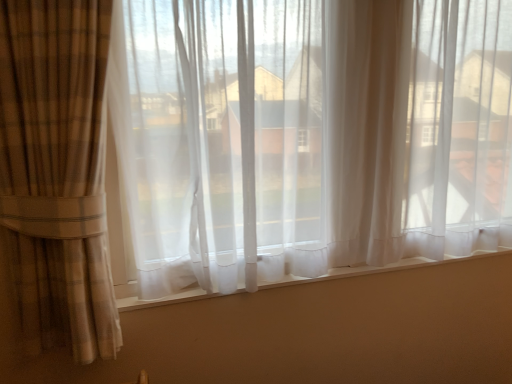
The width and height of the screenshot is (512, 384). Describe the element at coordinates (219, 140) in the screenshot. I see `translucent white curtain at center` at that location.

The image size is (512, 384). In order to click on translucent white curtain at center in this screenshot , I will do `click(219, 140)`.

Describe the element at coordinates (380, 269) in the screenshot. I see `white sheer curtain at center` at that location.

What are the coordinates of `white sheer curtain at center` in the screenshot? It's located at (380, 269).

Where is `translucent white curtain at center`? Image resolution: width=512 pixels, height=384 pixels. translucent white curtain at center is located at coordinates (219, 140).

From the picture: Based on their positions, is translucent white curtain at center located to the left or right of white sheer curtain at center?

translucent white curtain at center is to the right of white sheer curtain at center.

Is the depth of translucent white curtain at center less than that of white sheer curtain at center?

Yes.

Is point (267, 174) positioned before point (480, 251)?

Yes.

From the image's perspective, is translucent white curtain at center below white sheer curtain at center?

Actually, translucent white curtain at center appears above white sheer curtain at center in the image.

From a real-world perspective, is translucent white curtain at center physically located above or below white sheer curtain at center?

From a real-world perspective, translucent white curtain at center is physically above white sheer curtain at center.

Which of these two, translucent white curtain at center or white sheer curtain at center, is thinner?

white sheer curtain at center.

Is translucent white curtain at center taller than white sheer curtain at center?

Indeed, translucent white curtain at center has a greater height compared to white sheer curtain at center.

Is translucent white curtain at center smaller than white sheer curtain at center?

Incorrect, translucent white curtain at center is not smaller in size than white sheer curtain at center.

Is translucent white curtain at center not within white sheer curtain at center?

Yes, translucent white curtain at center is outside of white sheer curtain at center.

Is translucent white curtain at center not close to white sheer curtain at center?

That's not correct — translucent white curtain at center is a little close to white sheer curtain at center.

Is translucent white curtain at center oriented towards white sheer curtain at center?

No.

How many degrees apart are the facing directions of translucent white curtain at center and white sheer curtain at center?

0.000353 degrees.

Measure the distance between translucent white curtain at center and white sheer curtain at center.

translucent white curtain at center and white sheer curtain at center are 18.00 inches apart from each other.

At what (x,y) coordinates should I click in order to perform the action: click on window sill behind the translucent white curtain at center. Please return your answer as a coordinate pair (x, y). This screenshot has height=384, width=512. Looking at the image, I should click on (380, 269).

Considering the positions of objects white sheer curtain at center and translucent white curtain at center in the image provided, who is more to the right, white sheer curtain at center or translucent white curtain at center?

translucent white curtain at center is more to the right.

Is the position of white sheer curtain at center more distant than that of translucent white curtain at center?

Yes.

Which is behind, point (502, 250) or point (153, 188)?

The point (502, 250) is more distant.

From the image's perspective, is white sheer curtain at center located beneath translucent white curtain at center?

Indeed, from the image's perspective, white sheer curtain at center is shown beneath translucent white curtain at center.

From a real-world perspective, is white sheer curtain at center over translucent white curtain at center?

No, from a real-world perspective, white sheer curtain at center is not above translucent white curtain at center.

Considering the sizes of objects white sheer curtain at center and translucent white curtain at center in the image provided, who is thinner, white sheer curtain at center or translucent white curtain at center?

white sheer curtain at center.

Considering the relative sizes of white sheer curtain at center and translucent white curtain at center in the image provided, is white sheer curtain at center taller than translucent white curtain at center?

Incorrect, the height of white sheer curtain at center is not larger of that of translucent white curtain at center.

Does white sheer curtain at center have a larger size compared to translucent white curtain at center?

Incorrect, white sheer curtain at center is not larger than translucent white curtain at center.

Can we say white sheer curtain at center lies outside translucent white curtain at center?

No, white sheer curtain at center is not entirely external to translucent white curtain at center.

Is white sheer curtain at center touching translucent white curtain at center?

No, white sheer curtain at center is not beside translucent white curtain at center.

Is white sheer curtain at center positioned with its back to translucent white curtain at center?

Yes, white sheer curtain at center is positioned with its back facing translucent white curtain at center.

How different are the orientations of white sheer curtain at center and translucent white curtain at center in degrees?

There is a 0.000353-degree angle between the facing directions of white sheer curtain at center and translucent white curtain at center.

Find the location of a particular element. The width and height of the screenshot is (512, 384). window screen above the white sheer curtain at center (from the image's perspective) is located at coordinates (219, 140).

The width and height of the screenshot is (512, 384). Identify the location of window sill below the translucent white curtain at center (from the image's perspective). (380, 269).

You are a GUI agent. You are given a task and a screenshot of the screen. Output one action in this format:
    pyautogui.click(x=<x>, y=<y>)
    Task: Click on the window sill below the translucent white curtain at center (from a real-world perspective)
    This screenshot has width=512, height=384.
    Given the screenshot: What is the action you would take?
    pyautogui.click(x=380, y=269)